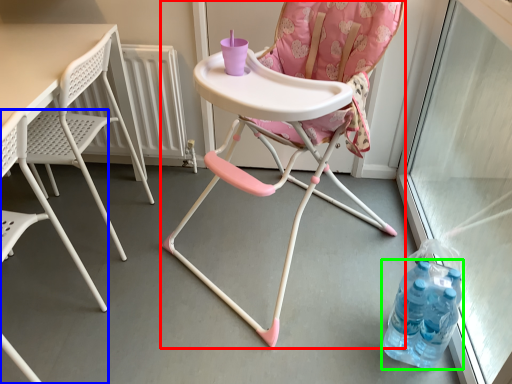
Question: Which object is positioned closest to chair (highlighted by a red box)? Select from chair (highlighted by a blue box) and bottle (highlighted by a green box).

Choices:
 (A) chair
 (B) bottle

Answer: (B)